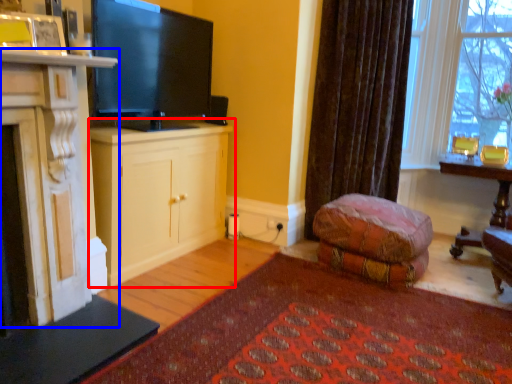
Question: Which object is closer to the camera taking this photo, cabinetry (highlighted by a red box) or cabinetry (highlighted by a blue box)?

Choices:
 (A) cabinetry
 (B) cabinetry

Answer: (B)